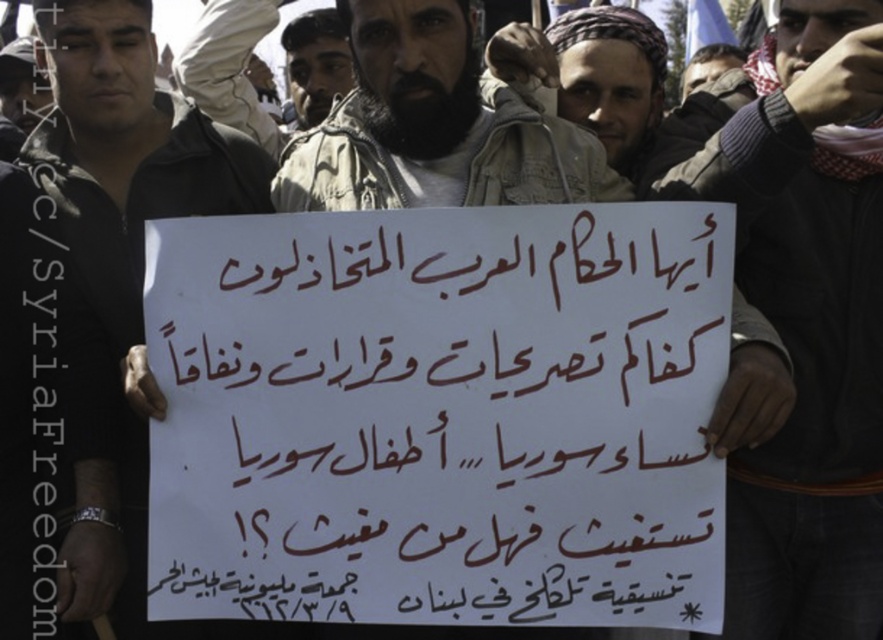
Question: Can you confirm if white paper sign at center is thinner than beige textured jacket at center?

Choices:
 (A) no
 (B) yes

Answer: (B)

Question: Based on their relative distances, which object is farther from the white paper sign at center?

Choices:
 (A) bearded man at center
 (B) white paper placard at center
 (C) dark gray sweater at center

Answer: (C)

Question: Is dark gray sweater at center closer to camera compared to beige textured jacket at center?

Choices:
 (A) no
 (B) yes

Answer: (B)

Question: Which of the following is the closest to the observer?

Choices:
 (A) white paper placard at center
 (B) bearded man at center
 (C) white paper sign at center
 (D) beige textured jacket at center

Answer: (A)

Question: Which of the following is the farthest from the observer?

Choices:
 (A) bearded man at center
 (B) white paper placard at center
 (C) dark gray sweater at center

Answer: (A)

Question: Does dark gray sweater at center have a smaller size compared to white paper sign at center?

Choices:
 (A) no
 (B) yes

Answer: (A)